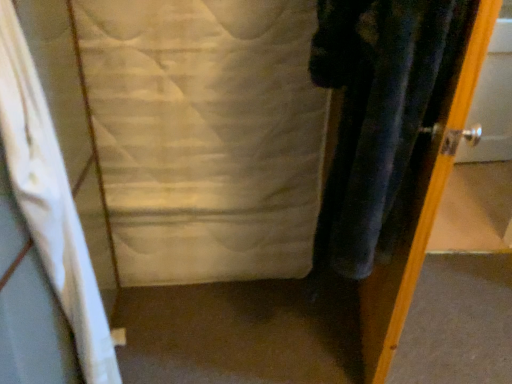
Where is `empty space that is in between metallic silver door at right and white quilted fabric at center`? The height and width of the screenshot is (384, 512). empty space that is in between metallic silver door at right and white quilted fabric at center is located at coordinates (267, 318).